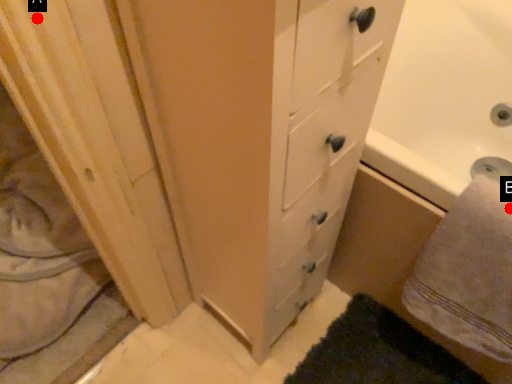
Question: Two points are circled on the image, labeled by A and B beside each circle. Which point is closer to the camera taking this photo?

Choices:
 (A) A is closer
 (B) B is closer

Answer: (A)